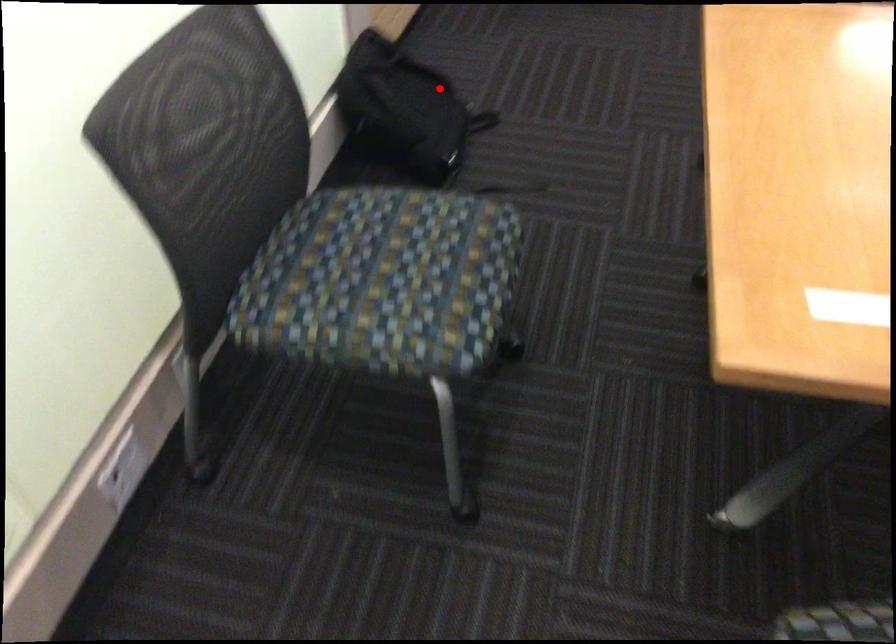
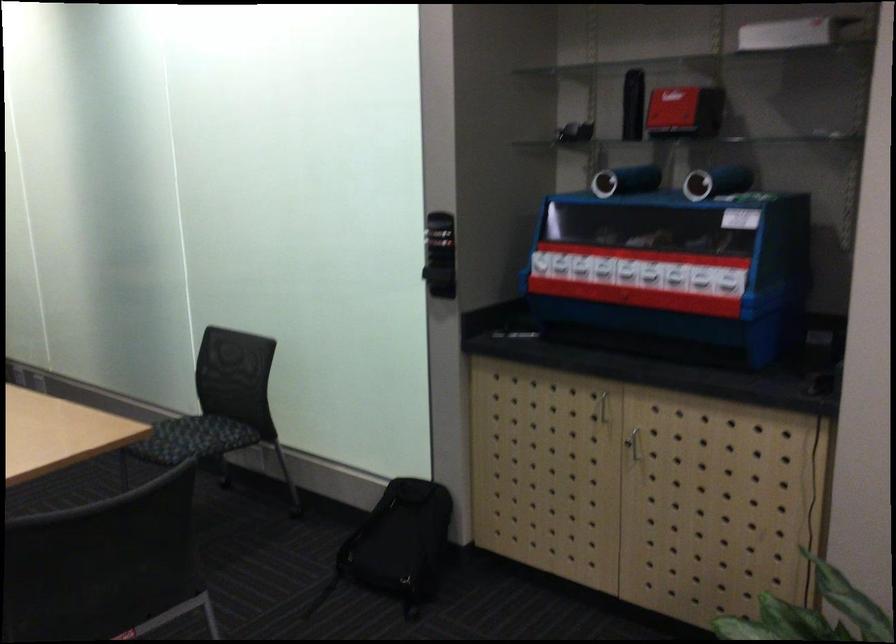
Question: A red point is marked in image1. In image2, is the corresponding 3D point closer to the camera or farther? Reply with the corresponding letter.

Choices:
 (A) The corresponding 3D point is closer.
 (B) The corresponding 3D point is farther.

Answer: (B)